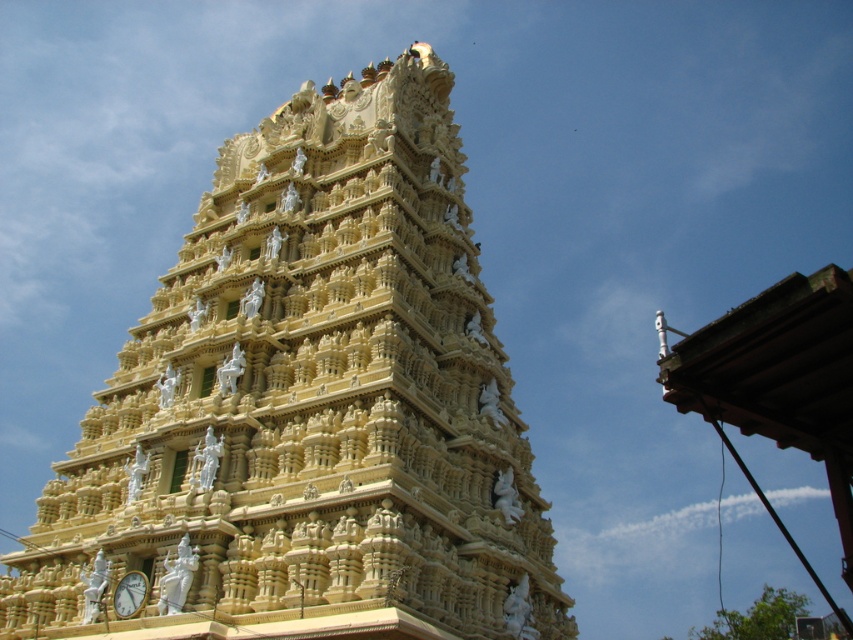
Question: Is golden stone temple at center smaller than metallic gold clock at bottom left?

Choices:
 (A) yes
 (B) no

Answer: (B)

Question: Does golden stone temple at center appear on the right side of metallic gold clock at bottom left?

Choices:
 (A) no
 (B) yes

Answer: (B)

Question: Which point appears farthest from the camera in this image?

Choices:
 (A) (244, 337)
 (B) (141, 608)

Answer: (A)

Question: Is golden stone temple at center positioned in front of metallic gold clock at bottom left?

Choices:
 (A) yes
 (B) no

Answer: (A)